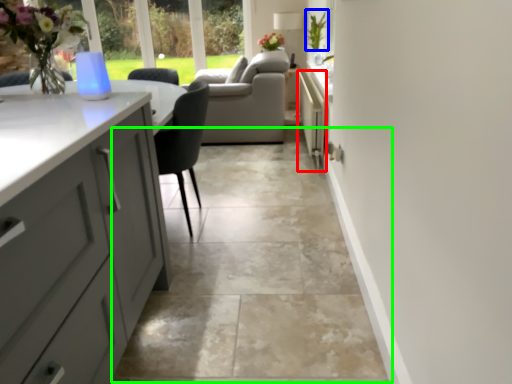
Question: Which object is positioned farthest from appliance (highlighted by a red box)? Select from plant (highlighted by a blue box) and path (highlighted by a green box).

Choices:
 (A) plant
 (B) path

Answer: (B)